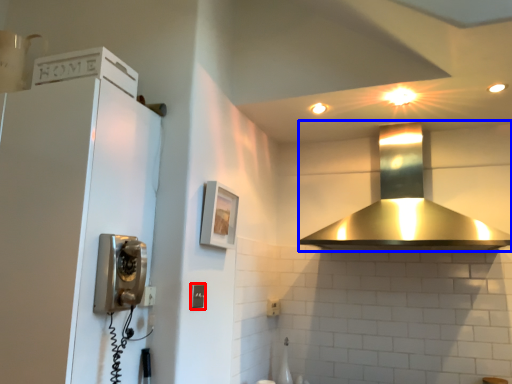
Question: Which object appears closest to the camera in this image, light switch (highlighted by a red box) or home appliance (highlighted by a blue box)?

Choices:
 (A) light switch
 (B) home appliance

Answer: (B)